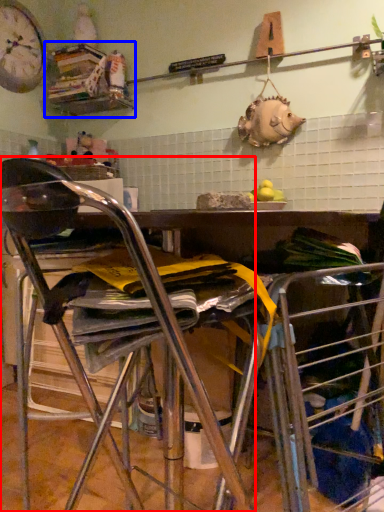
Question: Which of the following is the closest to the observer, chair (highlighted by a red box) or shelf (highlighted by a blue box)?

Choices:
 (A) chair
 (B) shelf

Answer: (A)